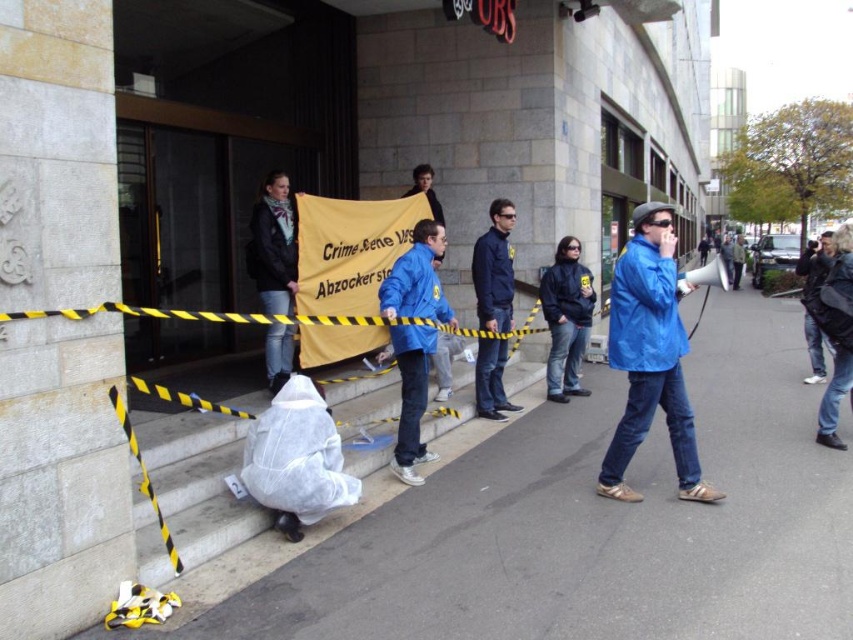
Can you confirm if white plastic bag at lower center is taller than blue jacket at center?

No, white plastic bag at lower center is not taller than blue jacket at center.

Who is shorter, white plastic bag at lower center or blue jacket at center?

white plastic bag at lower center

This screenshot has width=853, height=640. What do you see at coordinates (200, 481) in the screenshot? I see `white plastic bag at lower center` at bounding box center [200, 481].

What are the coordinates of `white plastic bag at lower center` in the screenshot? It's located at (200, 481).

The image size is (853, 640). What do you see at coordinates (589, 525) in the screenshot? I see `gray concrete pavement at lower left` at bounding box center [589, 525].

Is gray concrete pavement at lower left in front of blue fabric jacket at center?

That is True.

Describe the element at coordinates (589, 525) in the screenshot. Image resolution: width=853 pixels, height=640 pixels. I see `gray concrete pavement at lower left` at that location.

In order to click on gray concrete pavement at lower left in this screenshot , I will do `click(589, 525)`.

Between white plastic bag at lower center and denim jacket at lower right, which one is positioned higher?

denim jacket at lower right is above.

Is point (164, 509) positioned after point (804, 378)?

No.

Identify the location of white plastic bag at lower center. This screenshot has height=640, width=853. pyautogui.click(x=200, y=481).